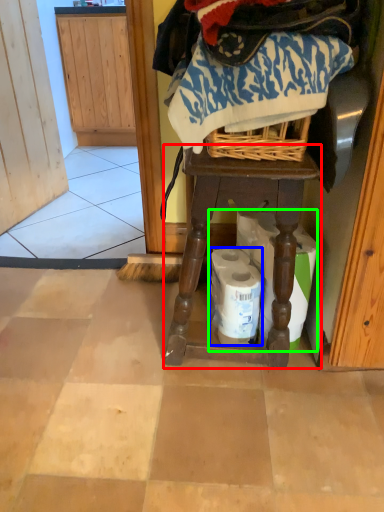
Question: Considering the real-world distances, which object is farthest from furniture (highlighted by a red box)? toilet paper (highlighted by a blue box) or toilet paper (highlighted by a green box)?

Choices:
 (A) toilet paper
 (B) toilet paper

Answer: (A)